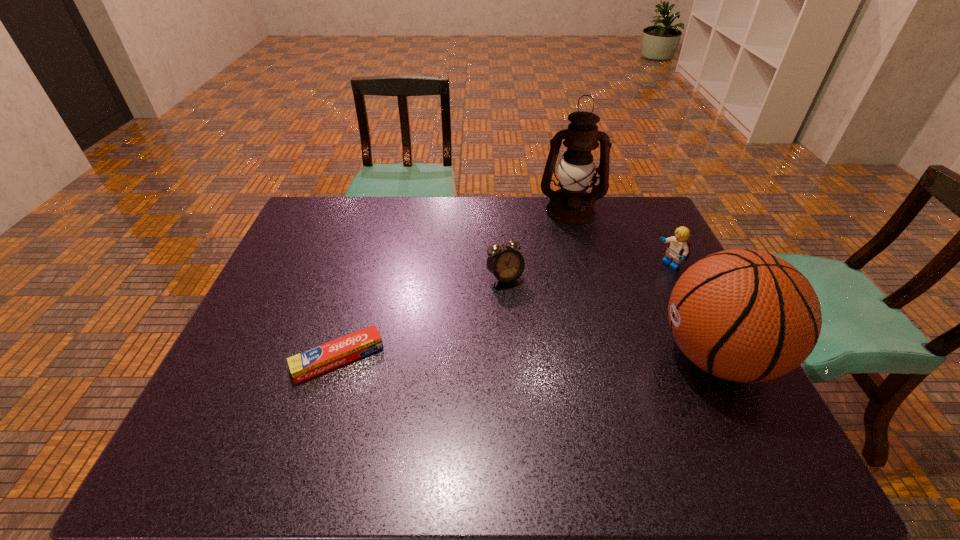
Locate an element on the screen. object that is at the far edge is located at coordinates (571, 205).

At what (x,y) coordinates should I click in order to perform the action: click on object located at the near edge. Please return your answer as a coordinate pair (x, y). The image size is (960, 540). Looking at the image, I should click on (743, 315).

You are a GUI agent. You are given a task and a screenshot of the screen. Output one action in this format:
    pyautogui.click(x=<x>, y=<y>)
    Task: Click on the object that is at the left edge
    
    Given the screenshot: What is the action you would take?
    pyautogui.click(x=320, y=359)

You are a GUI agent. You are given a task and a screenshot of the screen. Output one action in this format:
    pyautogui.click(x=<x>, y=<y>)
    Task: Click on the basketball at the right edge
    The image size is (960, 540).
    Given the screenshot: What is the action you would take?
    pyautogui.click(x=743, y=315)

Locate an element on the screen. Lego at the right edge is located at coordinates (678, 249).

The width and height of the screenshot is (960, 540). What are the coordinates of `object that is at the near right corner` in the screenshot? It's located at (743, 315).

Where is `blank space at the far edge of the desktop`? blank space at the far edge of the desktop is located at coordinates (520, 210).

In the image, there is a desktop. Identify the location of vacant region at the near edge. The width and height of the screenshot is (960, 540). (403, 388).

Find the location of a particular element. Image resolution: width=960 pixels, height=540 pixels. vacant region at the left edge of the desktop is located at coordinates (288, 241).

Locate an element on the screen. vacant area at the right edge of the desktop is located at coordinates (683, 352).